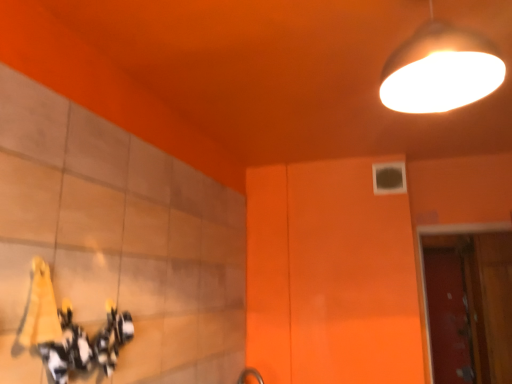
Describe the element at coordinates (440, 69) in the screenshot. This screenshot has height=384, width=512. I see `white glossy lampshade at upper right` at that location.

This screenshot has width=512, height=384. I want to click on white glossy lampshade at upper right, so click(440, 69).

Measure the distance between white glossy lampshade at upper right and camera.

white glossy lampshade at upper right is 3.51 feet away from camera.

At what (x,y) coordinates should I click in order to perform the action: click on white glossy lampshade at upper right. Please return your answer as a coordinate pair (x, y). Image resolution: width=512 pixels, height=384 pixels. Looking at the image, I should click on (440, 69).